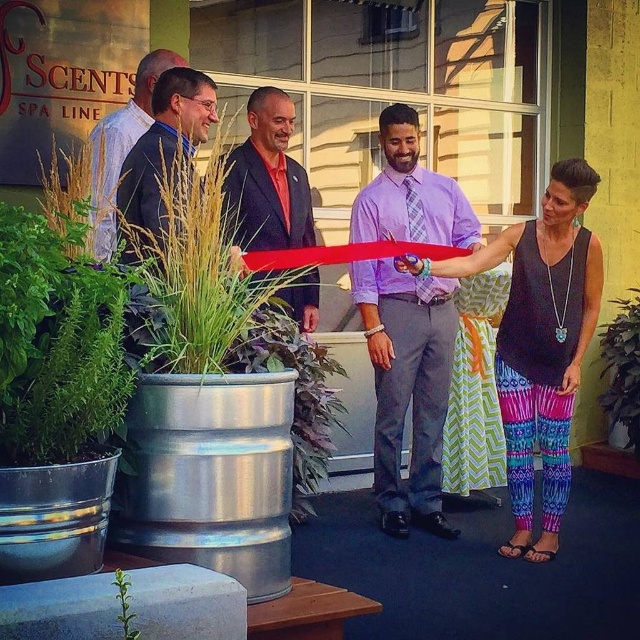
Does point (561, 160) lie in front of point (100, 170)?

That is False.

What do you see at coordinates (540, 342) in the screenshot? I see `black jersey at center` at bounding box center [540, 342].

Who is more distant from viewer, (570, 243) or (106, 220)?

The point (570, 243) is behind.

Where is `black jersey at center`? The width and height of the screenshot is (640, 640). black jersey at center is located at coordinates point(540,342).

Does dark blue suit at upper left have a lesser width compared to green leafy plant at lower left?

In fact, dark blue suit at upper left might be wider than green leafy plant at lower left.

Does point (99, 211) come closer to viewer compared to point (122, 588)?

No.

Is point (140, 83) more distant than point (124, 579)?

Yes.

Locate an element on the screen. dark blue suit at upper left is located at coordinates (122, 147).

Between lavender plaid shirt at center and green leafy plant at center, which one appears on the left side from the viewer's perspective?

lavender plaid shirt at center is more to the left.

Can you confirm if lavender plaid shirt at center is wider than green leafy plant at center?

Correct, the width of lavender plaid shirt at center exceeds that of green leafy plant at center.

Identify the location of lavender plaid shirt at center. The height and width of the screenshot is (640, 640). (406, 387).